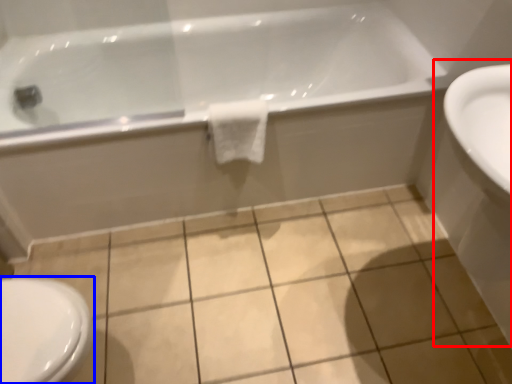
Question: Which of the following is the closest to the observer, sink (highlighted by a red box) or bidet (highlighted by a blue box)?

Choices:
 (A) sink
 (B) bidet

Answer: (A)